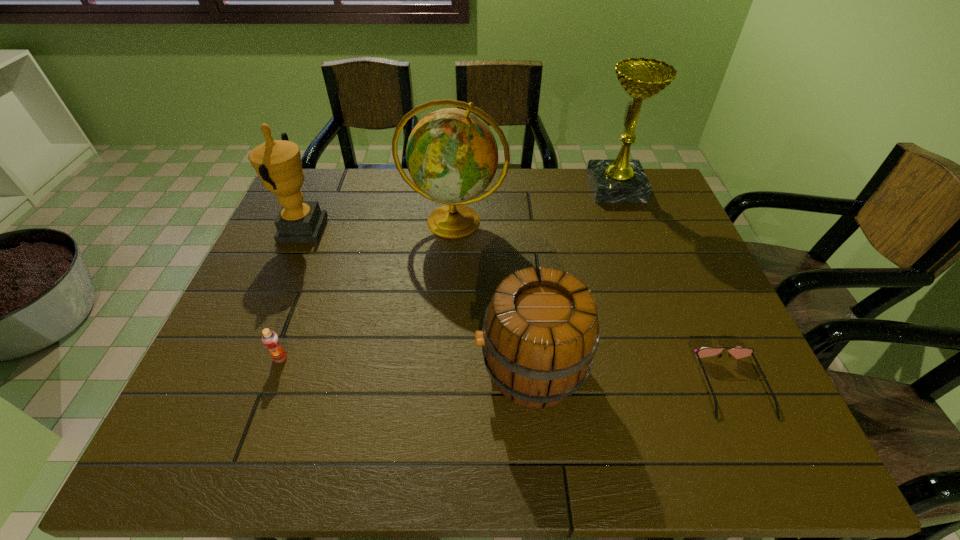
You are a GUI agent. You are given a task and a screenshot of the screen. Output one action in this format:
    pyautogui.click(x=<x>, y=<y>)
    Task: Click on the free space that satisfies the following two spatial constraints: 1. at the front of the left award with handles; 2. on the left side of the second shortest object
    
    Given the screenshot: What is the action you would take?
    pyautogui.click(x=246, y=358)